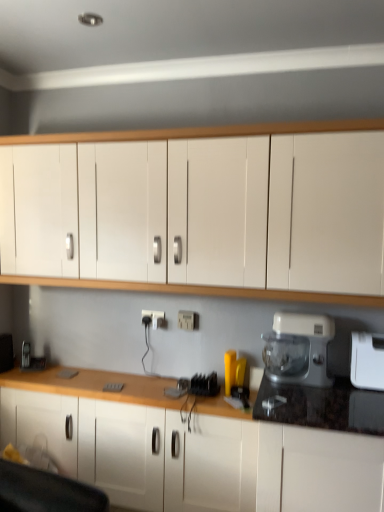
Question: From the image's perspective, is white plastic electric outlet at center, arranged as the first electric outlet when viewed from the back, beneath white plastic toaster at right?

Choices:
 (A) no
 (B) yes

Answer: (A)

Question: Does white plastic electric outlet at center, arranged as the 2th electric outlet when viewed from the right, have a larger size compared to white plastic toaster at right?

Choices:
 (A) no
 (B) yes

Answer: (A)

Question: From a real-world perspective, is white plastic electric outlet at center, arranged as the first electric outlet when viewed from the back, under white plastic toaster at right?

Choices:
 (A) yes
 (B) no

Answer: (B)

Question: Is white plastic electric outlet at center, the 1th electric outlet viewed from the left, shorter than white plastic toaster at right?

Choices:
 (A) yes
 (B) no

Answer: (A)

Question: Can you see white plastic electric outlet at center, arranged as the 2th electric outlet when viewed from the right, touching white plastic toaster at right?

Choices:
 (A) no
 (B) yes

Answer: (A)

Question: Is white plastic food processor at right to the left or to the right of white plastic electric outlet at center, the 1th electric outlet from the front, in the image?

Choices:
 (A) left
 (B) right

Answer: (B)

Question: From the image's perspective, is white plastic food processor at right located above or below white plastic electric outlet at center, which is the 2th electric outlet from left to right?

Choices:
 (A) below
 (B) above

Answer: (A)

Question: Considering the positions of point (263, 337) and point (187, 329), is point (263, 337) closer or farther from the camera than point (187, 329)?

Choices:
 (A) farther
 (B) closer

Answer: (B)

Question: Considering their positions, is white plastic food processor at right located in front of or behind white plastic electric outlet at center, positioned as the 2th electric outlet in back-to-front order?

Choices:
 (A) behind
 (B) front

Answer: (B)

Question: Considering the positions of white plastic food processor at right and white plastic toaster at right in the image, is white plastic food processor at right bigger or smaller than white plastic toaster at right?

Choices:
 (A) big
 (B) small

Answer: (A)

Question: Looking at their shapes, would you say white plastic food processor at right is wider or thinner than white plastic toaster at right?

Choices:
 (A) thin
 (B) wide

Answer: (A)

Question: Is white plastic food processor at right taller or shorter than white plastic toaster at right?

Choices:
 (A) tall
 (B) short

Answer: (A)

Question: From a real-world perspective, relative to white plastic toaster at right, is white plastic food processor at right vertically above or below?

Choices:
 (A) above
 (B) below

Answer: (A)

Question: Considering the relative positions of white plastic electric outlet at center, arranged as the first electric outlet when viewed from the back, and white plastic food processor at right in the image provided, is white plastic electric outlet at center, arranged as the first electric outlet when viewed from the back, to the left or to the right of white plastic food processor at right?

Choices:
 (A) left
 (B) right

Answer: (A)

Question: From the image's perspective, is white plastic electric outlet at center, the second electric outlet positioned from the front, positioned above or below white plastic food processor at right?

Choices:
 (A) below
 (B) above

Answer: (B)